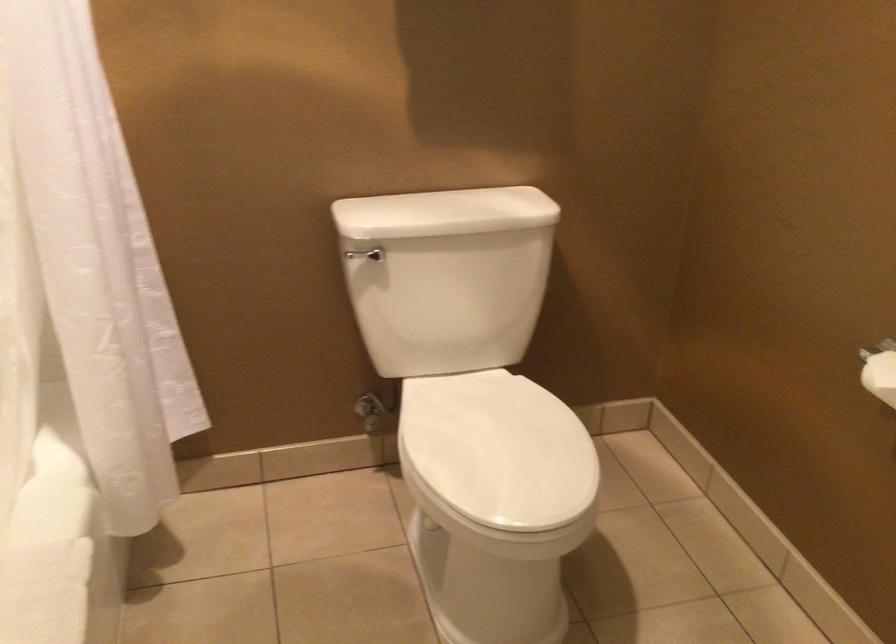
Find where to turn the silver water valve. Please return your answer as a coordinate pair (x, y).

(371, 412)